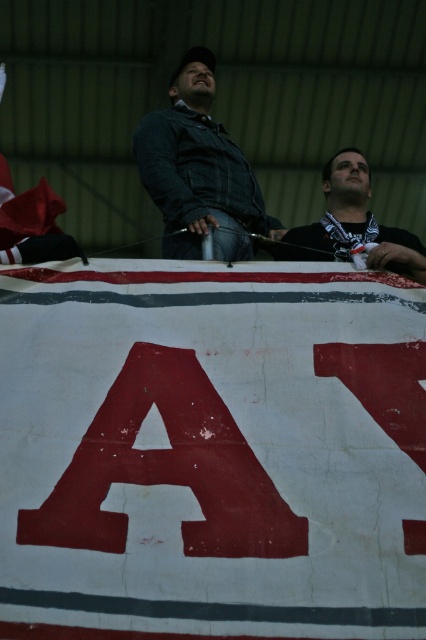
Question: Based on their relative distances, which object is nearer to the red fabric banner at center?

Choices:
 (A) dark blue denim jacket at center
 (B) black matte shirt at center

Answer: (B)

Question: Is red fabric banner at center smaller than dark blue denim jacket at center?

Choices:
 (A) no
 (B) yes

Answer: (B)

Question: Based on their relative distances, which object is farther from the black matte shirt at center?

Choices:
 (A) dark blue denim jacket at center
 (B) red fabric banner at center

Answer: (B)

Question: Can you confirm if red fabric banner at center is positioned to the right of dark blue denim jacket at center?

Choices:
 (A) no
 (B) yes

Answer: (A)

Question: Which of the following is the closest to the observer?

Choices:
 (A) (284, 248)
 (B) (183, 122)
 (C) (54, 339)

Answer: (C)

Question: Is red fabric banner at center to the right of dark blue denim jacket at center from the viewer's perspective?

Choices:
 (A) yes
 (B) no

Answer: (B)